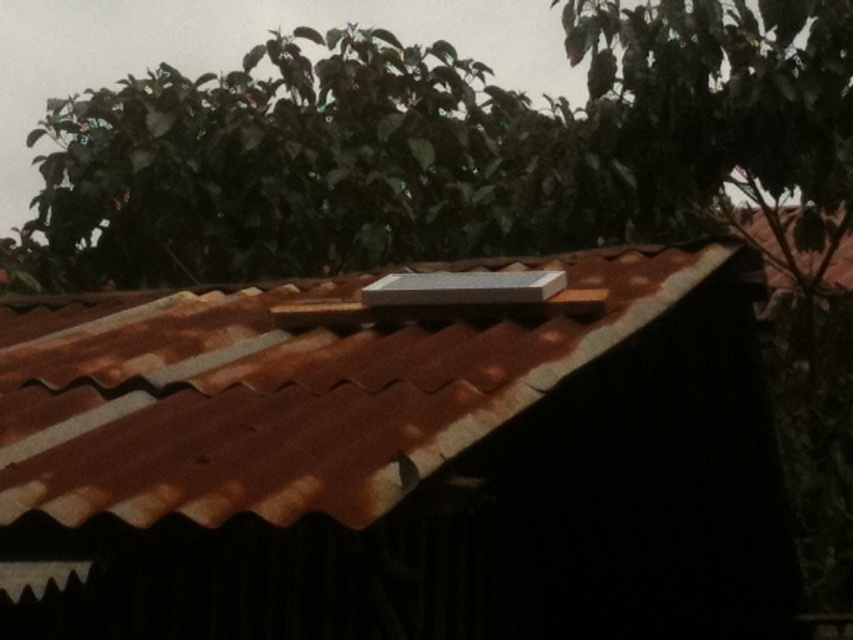
Question: Is rusty metal roof at center bigger than green leafy tree at upper center?

Choices:
 (A) no
 (B) yes

Answer: (A)

Question: Which of the following is the farthest from the observer?

Choices:
 (A) green leafy tree at upper center
 (B) rusty metal roof at center

Answer: (A)

Question: Does rusty metal roof at center appear under green leafy tree at upper center?

Choices:
 (A) no
 (B) yes

Answer: (B)

Question: Does rusty metal roof at center appear under green leafy tree at upper center?

Choices:
 (A) yes
 (B) no

Answer: (A)